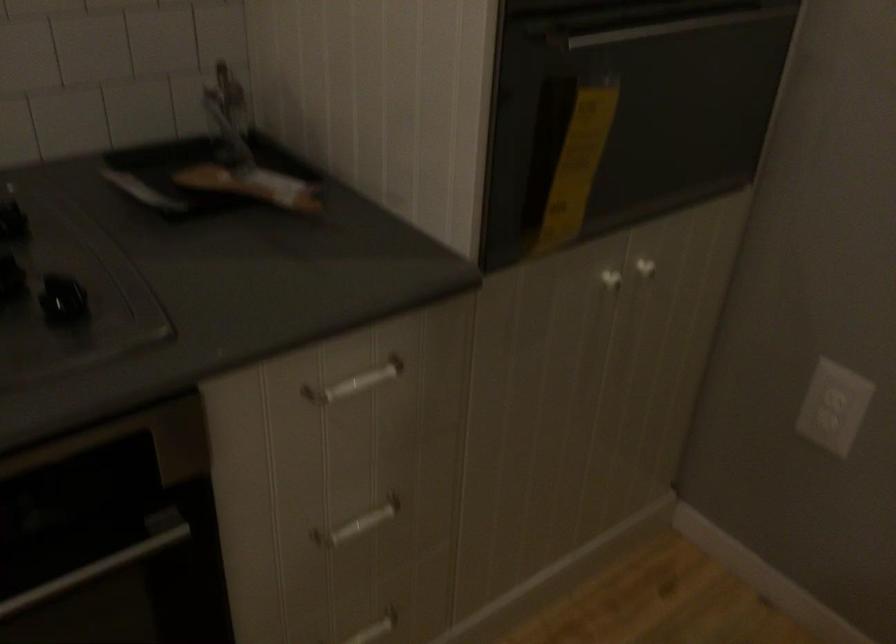
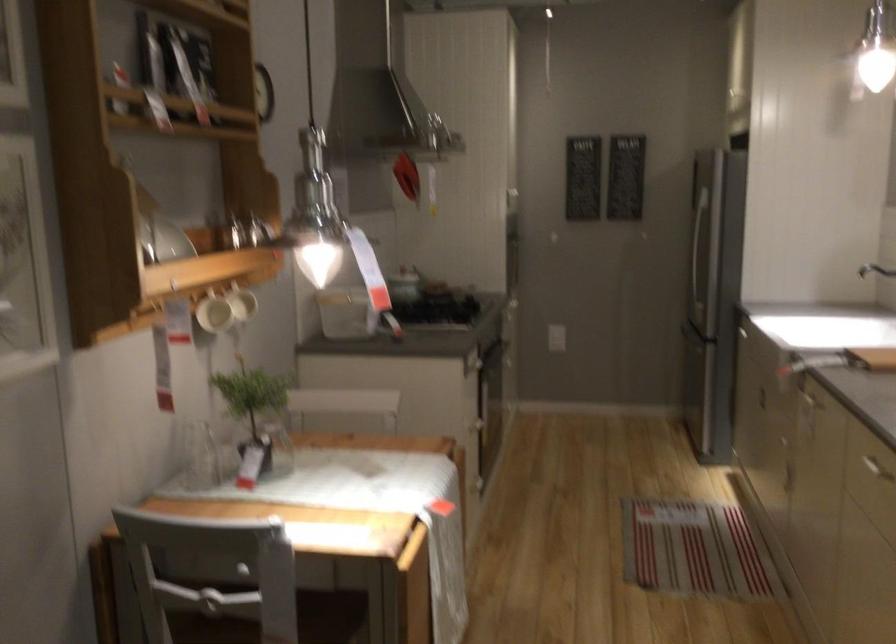
Question: I am providing you with two images of the same scene from different viewpoints. Please identify which objects are invisible in image2.

Choices:
 (A) refrigerator door handle
 (B) oven door handle
 (C) round wall switch
 (D) metal oven handle

Answer: (D)